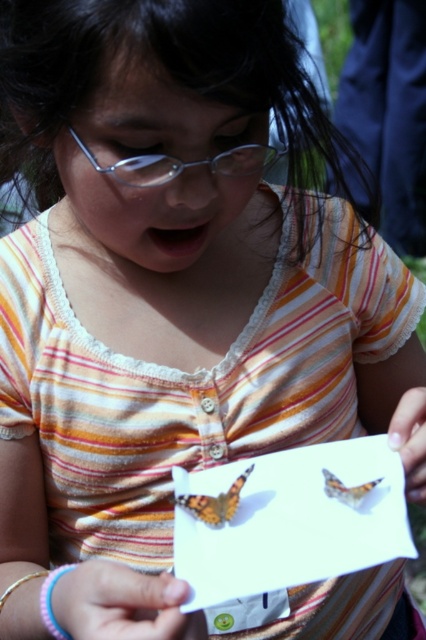
Is clear plastic glasses at center to the right of orange patterned butterfly at center from the viewer's perspective?

In fact, clear plastic glasses at center is to the left of orange patterned butterfly at center.

In order to click on clear plastic glasses at center in this screenshot , I will do (x=183, y=163).

Between clear plastic glasses at center and orange and black butterfly at center, which one appears on the left side from the viewer's perspective?

Positioned to the left is clear plastic glasses at center.

Who is more distant from viewer, (163,173) or (229,493)?

Point (229,493)

Image resolution: width=426 pixels, height=640 pixels. I want to click on clear plastic glasses at center, so click(x=183, y=163).

How much distance is there between orange and black butterfly at center and orange patterned butterfly at center?

They are 3.59 inches apart.

Consider the image. Is orange and black butterfly at center shorter than orange patterned butterfly at center?

In fact, orange and black butterfly at center may be taller than orange patterned butterfly at center.

Is point (181, 500) positioned after point (368, 484)?

That is True.

This screenshot has height=640, width=426. What are the coordinates of `orange and black butterfly at center` in the screenshot? It's located at (215, 502).